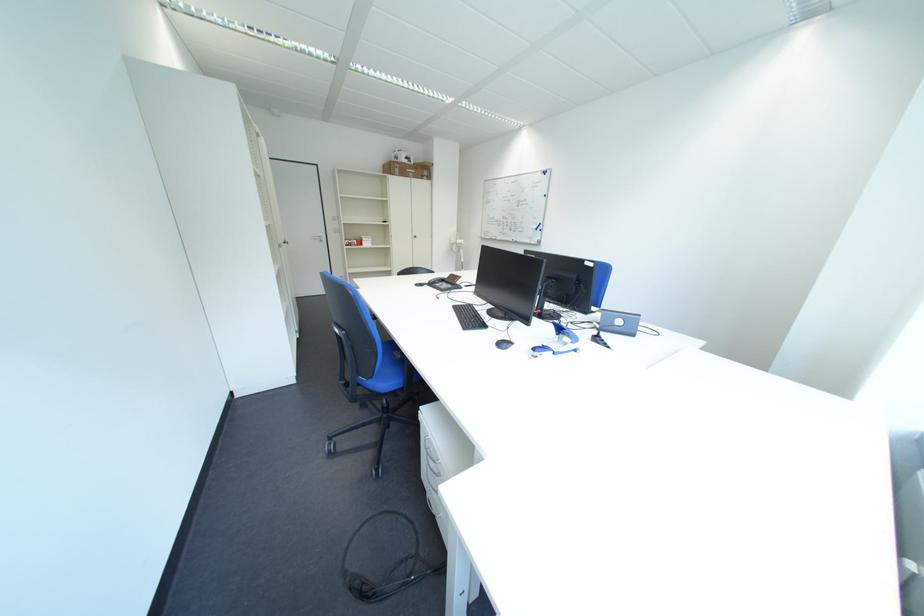
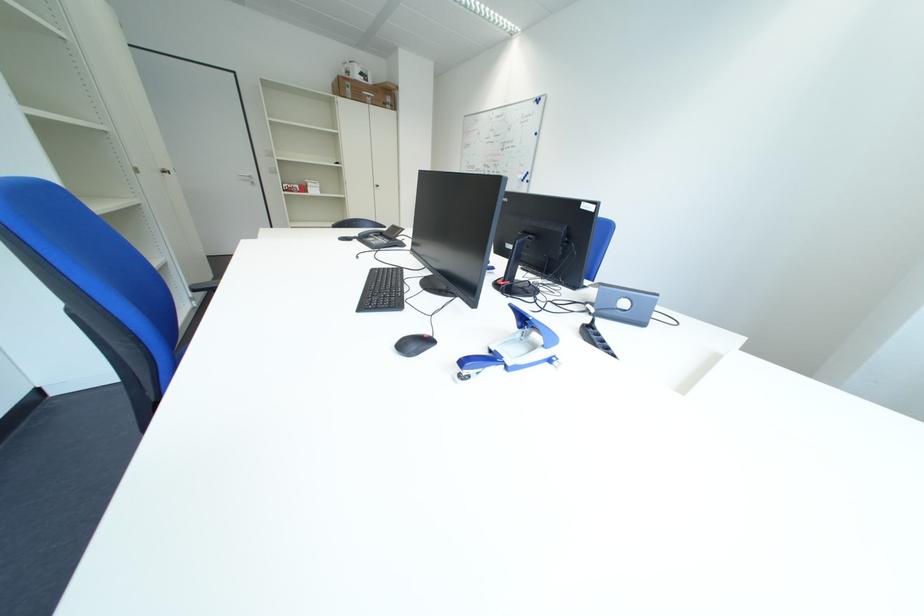
Where in the second image is the point corresponding to pixel 516 347 from the first image?

(426, 346)